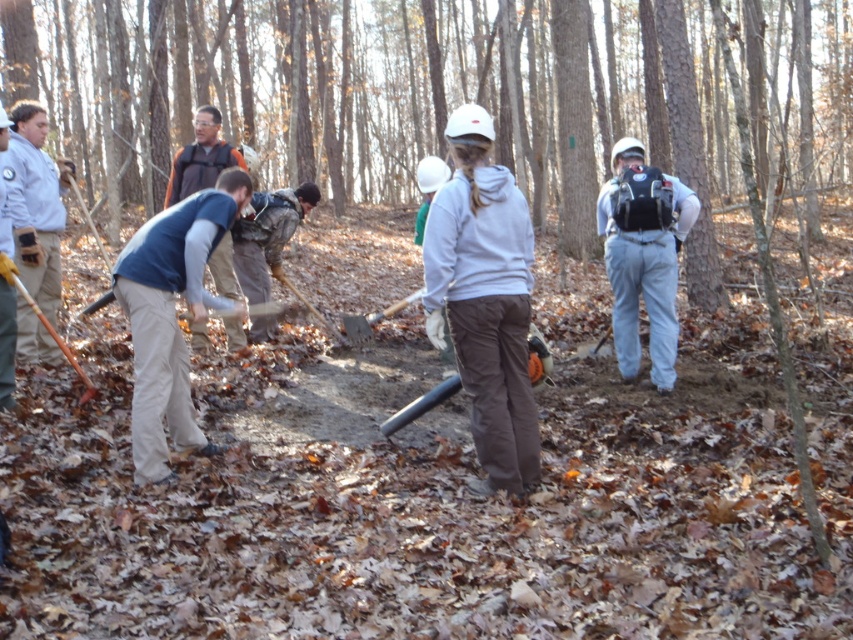
Does point (149, 412) lie in front of point (74, 362)?

Yes, it is in front of point (74, 362).

Is blue fabric shirt at left shorter than wooden shovel at left?

No.

Is point (146, 456) farther from camera compared to point (71, 364)?

No, (146, 456) is in front of (71, 364).

Locate an element on the screen. The height and width of the screenshot is (640, 853). blue fabric shirt at left is located at coordinates (171, 316).

The width and height of the screenshot is (853, 640). Identify the location of light gray shirt at left. (35, 204).

Between light gray shirt at left and wooden handle shovel at center, which one has more height?

light gray shirt at left

Between point (19, 164) and point (347, 323), which one is positioned in front?

Point (19, 164)

Where is `light gray shirt at left`? light gray shirt at left is located at coordinates (35, 204).

Looking at this image, can you confirm if wooden handle shovel at center is positioned to the left of wooden shovel at left?

No, wooden handle shovel at center is not to the left of wooden shovel at left.

Is point (360, 333) in front of point (90, 385)?

No, (360, 333) is behind (90, 385).

Locate an element on the screen. The height and width of the screenshot is (640, 853). wooden handle shovel at center is located at coordinates 372,320.

Find the location of a particular element. wooden handle shovel at center is located at coordinates (372, 320).